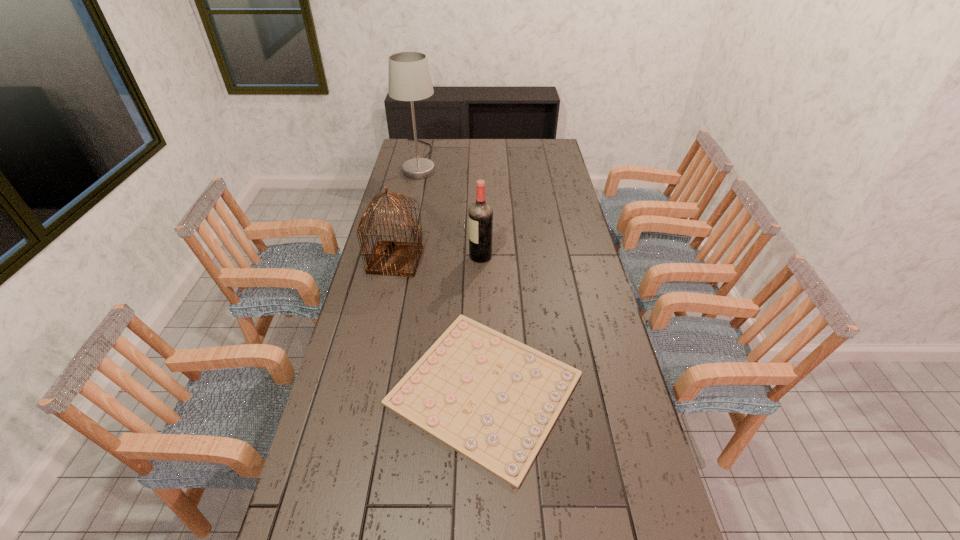
Find the location of a particular element. the tallest object is located at coordinates (409, 79).

In order to click on table lamp in this screenshot , I will do `click(409, 79)`.

I want to click on liquor, so click(480, 215).

You are a GUI agent. You are given a task and a screenshot of the screen. Output one action in this format:
    pyautogui.click(x=<x>, y=<y>)
    Task: Click on the birdcage
    
    Given the screenshot: What is the action you would take?
    pyautogui.click(x=394, y=258)

Identify the location of gameboard. (493, 399).

Find the location of a particular element. The image size is (960, 540). the nearest object is located at coordinates (493, 399).

Where is `vacant space located on the front of the farthest object`? Image resolution: width=960 pixels, height=540 pixels. vacant space located on the front of the farthest object is located at coordinates (416, 188).

Find the location of a particular element. The width and height of the screenshot is (960, 540). vacant area located 0.300m on the front-facing side of the liquor is located at coordinates (395, 256).

Locate an element on the screen. The image size is (960, 540). blank area located on the front-facing side of the liquor is located at coordinates (379, 256).

Find the location of a particular element. This screenshot has width=960, height=540. blank space located 0.310m on the front-facing side of the liquor is located at coordinates (392, 256).